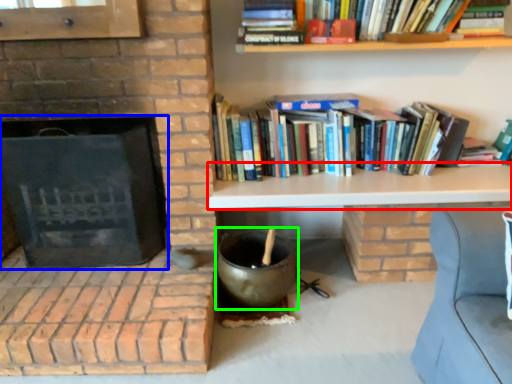
Question: Based on their relative distances, which object is farther from table (highlighted by a red box)? Choose from fireplace (highlighted by a blue box) and wok (highlighted by a green box).

Choices:
 (A) fireplace
 (B) wok

Answer: (A)